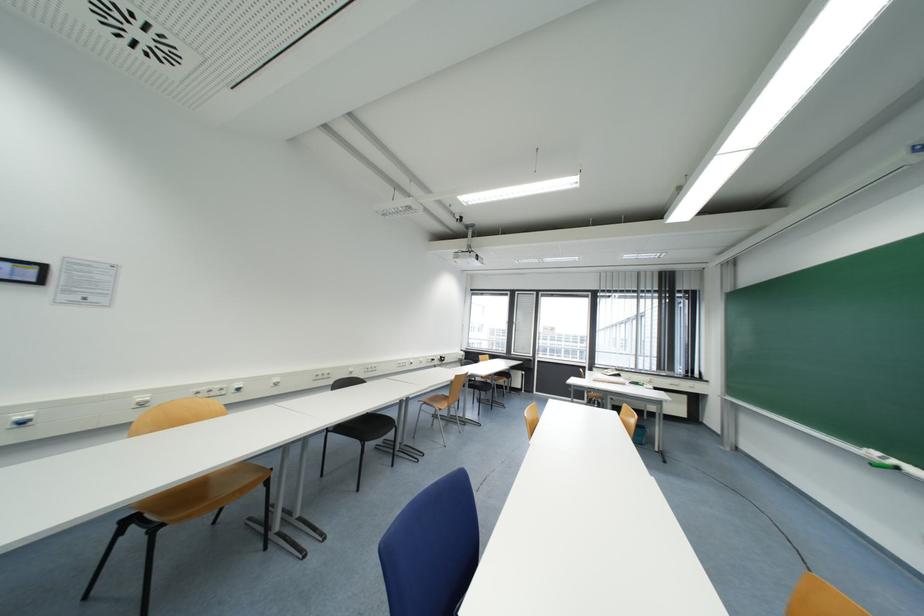
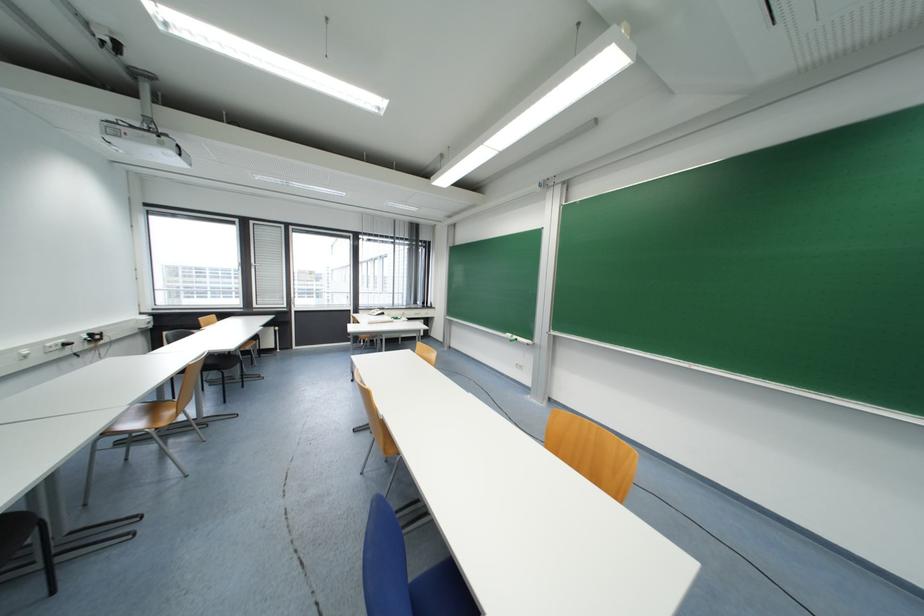
Question: The camera is either moving clockwise (left) or counter-clockwise (right) around the object. The first image is from the beginning of the video and the second image is from the end. Is the camera moving left or right when shooting the video?

Choices:
 (A) Left
 (B) Right

Answer: (A)